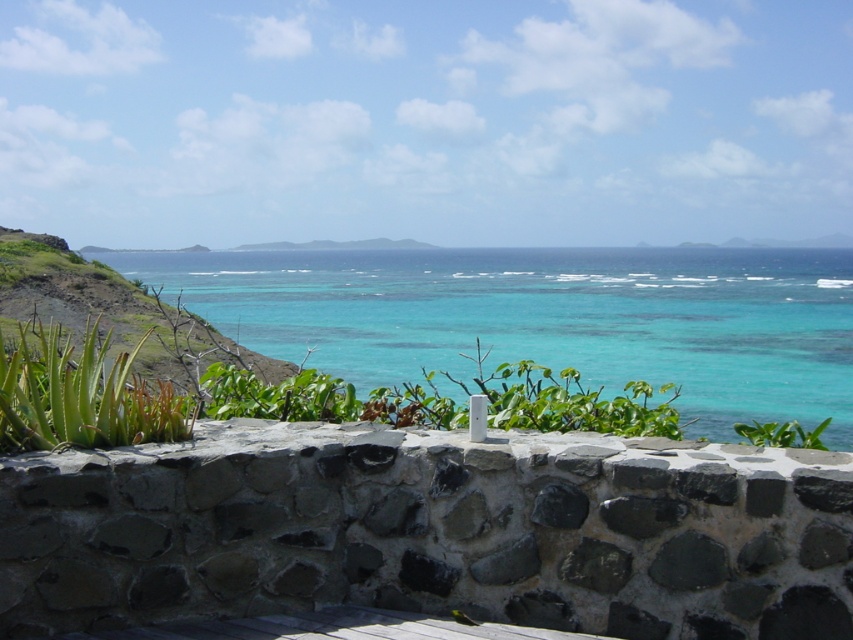
Question: Is turquoise water at center in front of green succulent at lower left?

Choices:
 (A) yes
 (B) no

Answer: (B)

Question: Which object appears closest to the camera in this image?

Choices:
 (A) gray stone ledge at center
 (B) turquoise water at center

Answer: (A)

Question: Among these objects, which one is nearest to the camera?

Choices:
 (A) gray stone ledge at center
 (B) green succulent at lower left
 (C) turquoise water at center

Answer: (A)

Question: Can you confirm if turquoise water at center is thinner than green succulent at lower left?

Choices:
 (A) no
 (B) yes

Answer: (A)

Question: Which point appears closest to the camera in this image?

Choices:
 (A) (564, 458)
 (B) (41, 372)

Answer: (A)

Question: Does gray stone ledge at center have a lesser width compared to green succulent at lower left?

Choices:
 (A) yes
 (B) no

Answer: (A)